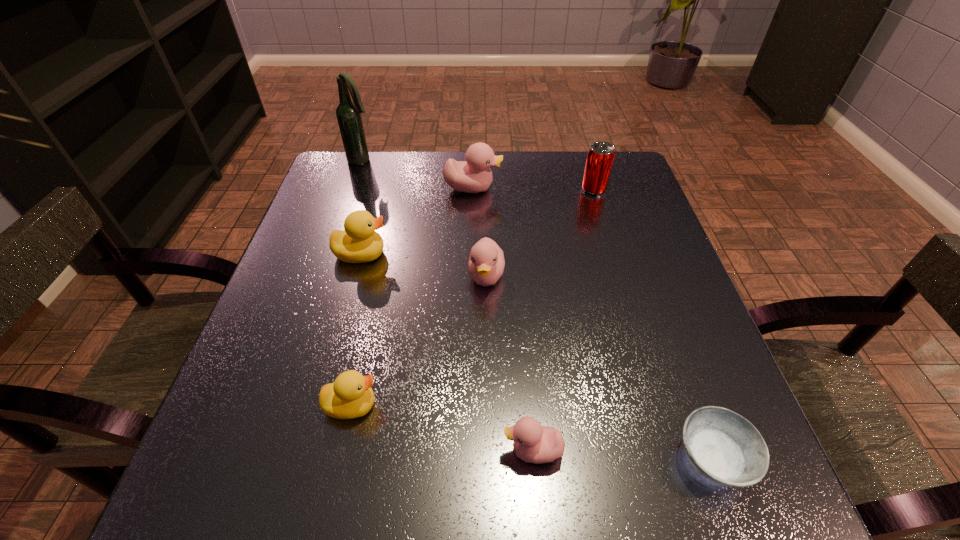
Locate an element on the screen. Image resolution: width=960 pixels, height=540 pixels. the nearest duckling is located at coordinates (533, 443).

Locate an element on the screen. the shortest object is located at coordinates (724, 447).

Locate an element on the screen. This screenshot has width=960, height=540. free space located 0.130m on the front of the tallest object is located at coordinates (350, 194).

Find the location of a particular element. The width and height of the screenshot is (960, 540). vacant area situated 0.210m on the front-facing side of the farthest duckling is located at coordinates click(x=583, y=188).

Identify the location of vacant point located 0.300m on the left of the red soda can. (465, 190).

I want to click on vacant space situated 0.360m on the face of the farther yellow duckling, so click(x=553, y=254).

Find the location of a particular element. free space located on the front-facing side of the second farthest pink duckling is located at coordinates (488, 377).

This screenshot has width=960, height=540. I want to click on free point located 0.090m on the face of the fourth farthest duckling, so click(x=435, y=405).

The image size is (960, 540). What are the coordinates of `free region located on the front-facing side of the nearest duckling` in the screenshot? It's located at (330, 451).

This screenshot has width=960, height=540. Find the location of `vacant point located 0.270m on the front-facing side of the nearest duckling`. vacant point located 0.270m on the front-facing side of the nearest duckling is located at coordinates (324, 451).